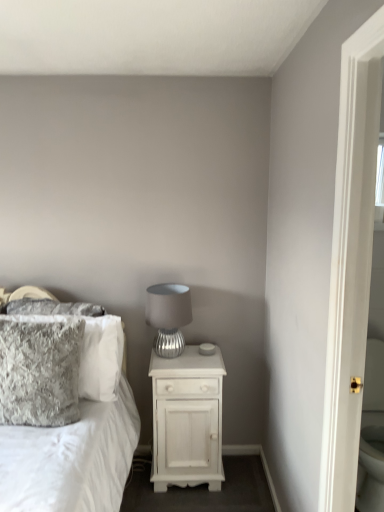
Identify the location of vacant area on top of white wood nightstand at center (from a real-world perspective). The image size is (384, 512). (184, 359).